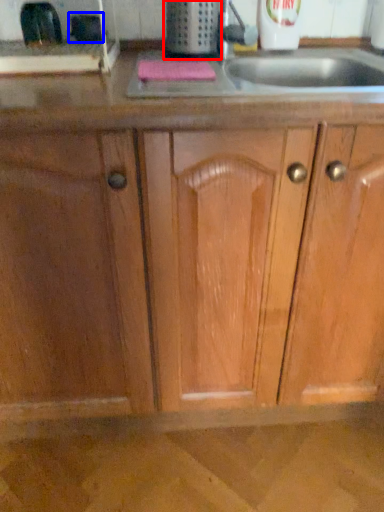
Question: Which object appears closest to the camera in this image, appliance (highlighted by a red box) or appliance (highlighted by a blue box)?

Choices:
 (A) appliance
 (B) appliance

Answer: (A)